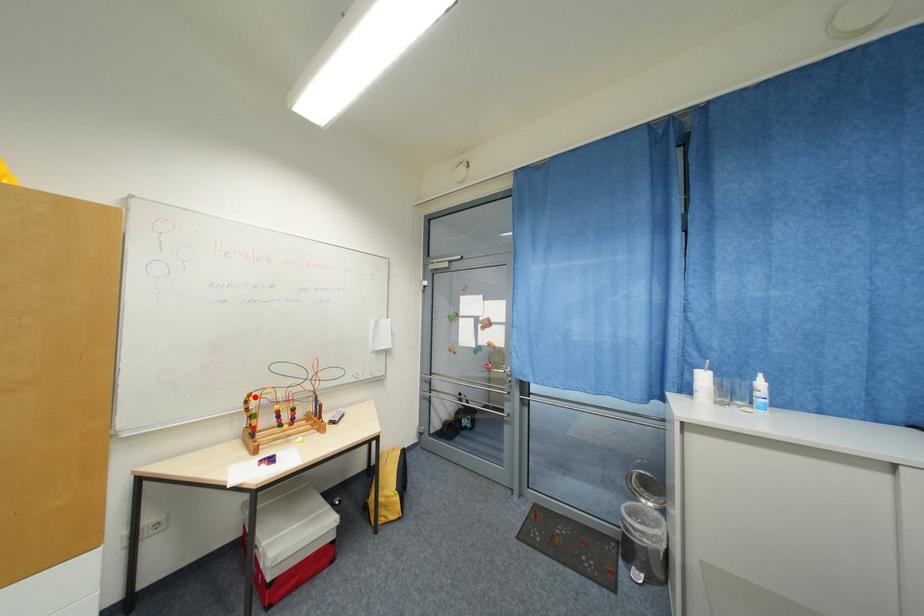
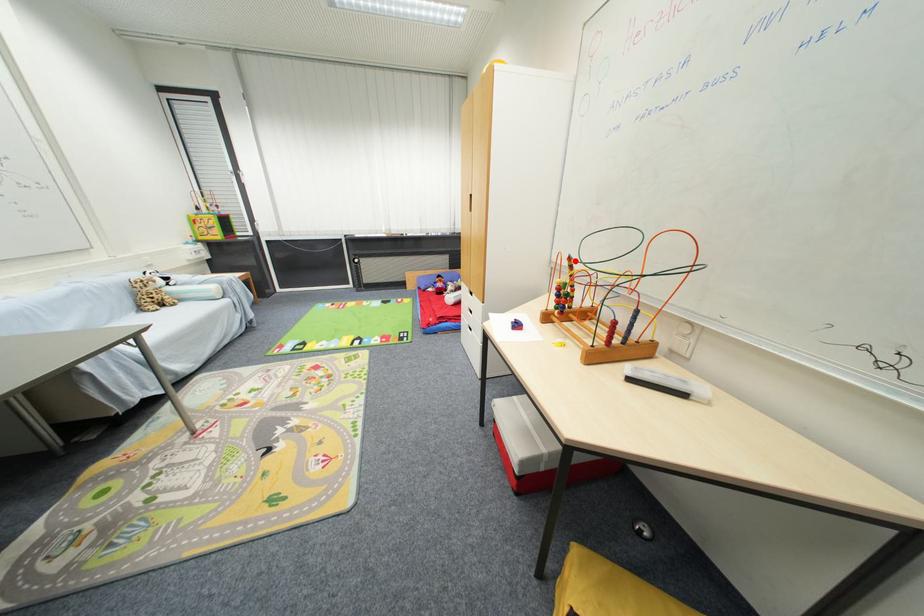
I am providing you with two images of the same scene from different viewpoints. A red point is marked on the first image and another point is marked on the second image. Do the highlighted points in image1 and image2 indicate the same real-world spot?

Yes